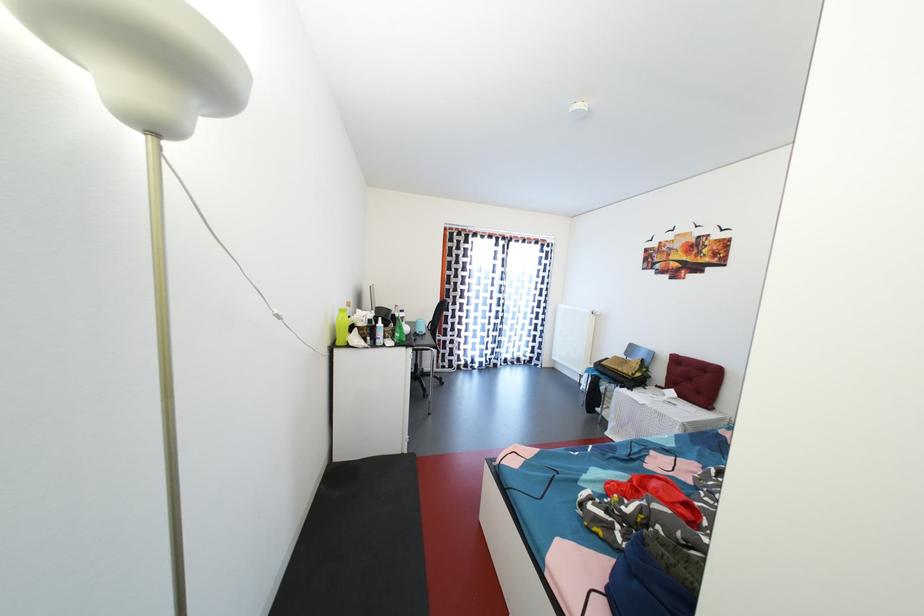
Find where to lift the green plastic bottle. Please return your answer as a coordinate pair (x, y).

(342, 326)